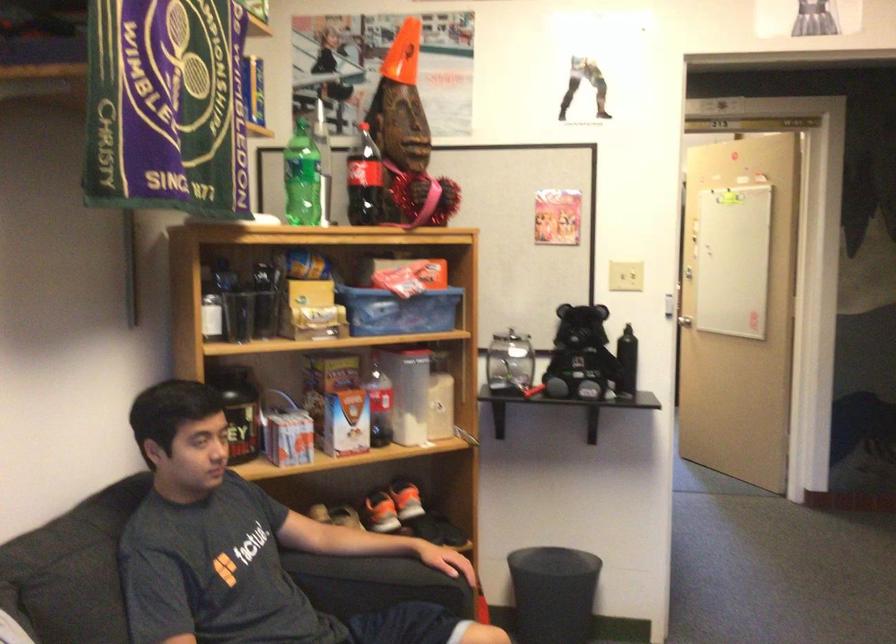
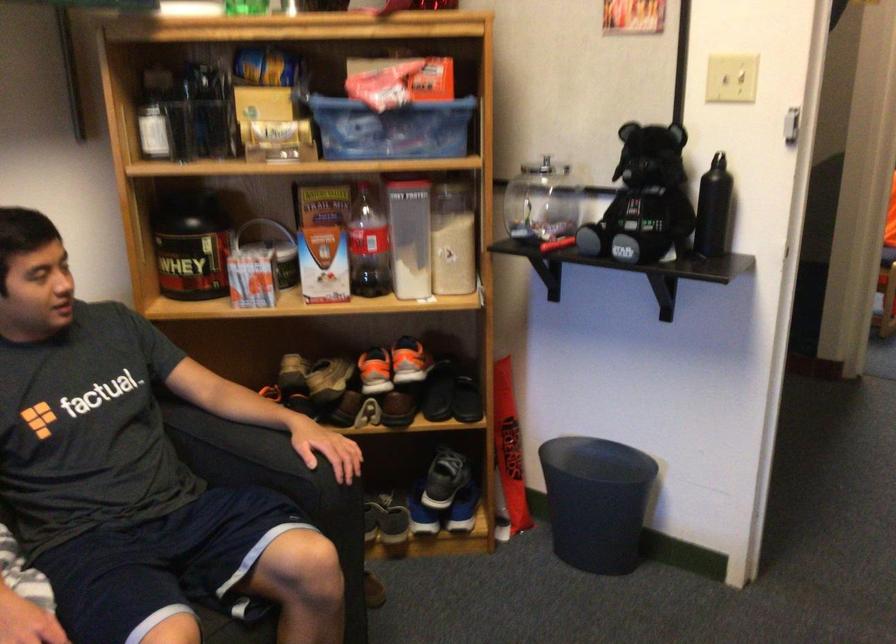
The point at (549, 564) is marked in the first image. Where is the corresponding point in the second image?

(597, 460)